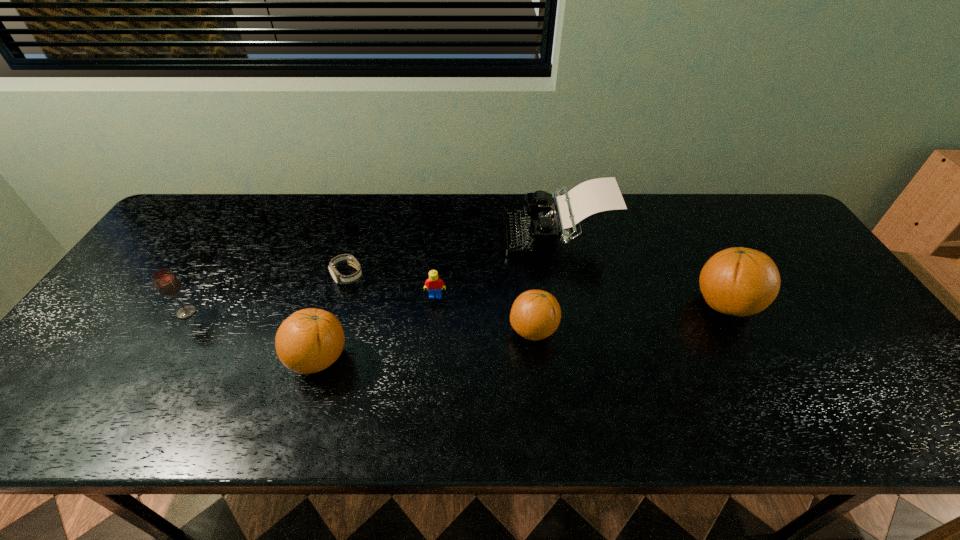
I want to click on free space that satisfies the following two spatial constraints: 1. on the back side of the leftmost orange; 2. on the left side of the rightmost orange, so click(335, 305).

The image size is (960, 540). I want to click on free location that satisfies the following two spatial constraints: 1. on the back side of the second orange from right to left; 2. on the right side of the rightmost object, so click(x=531, y=305).

The width and height of the screenshot is (960, 540). I want to click on vacant space that satisfies the following two spatial constraints: 1. on the face of the watch; 2. on the left side of the rightmost orange, so click(339, 305).